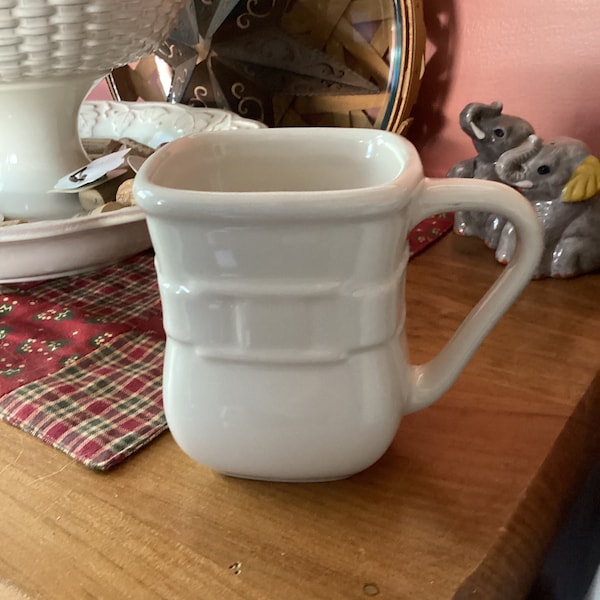
Find the location of a particular element. Image resolution: width=600 pixels, height=600 pixels. elephant figurine is located at coordinates (508, 126).